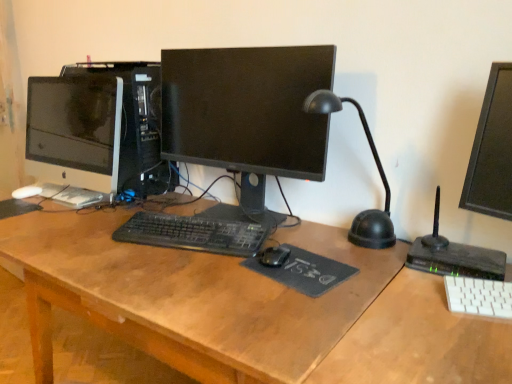
Find the location of a particular element. Image resolution: width=512 pixels, height=384 pixels. black glossy monitor at center, the 2th computer monitor viewed from the left is located at coordinates click(x=247, y=108).

Locate an element on the screen. This screenshot has height=384, width=512. black rubber mousepad at center, which is the second mousepad from bottom to top is located at coordinates (16, 208).

How much space does black rubber mousepad at center, which ranks as the first mousepad in back-to-front order, occupy vertically?

The height of black rubber mousepad at center, which ranks as the first mousepad in back-to-front order, is 0.76 inches.

This screenshot has width=512, height=384. Identify the location of black matte keyboard at center, which is counted as the second computer keyboard, starting from the front. (193, 233).

The height and width of the screenshot is (384, 512). What are the coordinates of `black plastic computer tower at center` in the screenshot? It's located at (137, 126).

Where is `black matte mouse at center`? This screenshot has width=512, height=384. black matte mouse at center is located at coordinates pos(274,256).

From the image's perspective, which is below, black rubber mousepad at center, which is the second mousepad from bottom to top, or black plastic desk lamp at center right?

black rubber mousepad at center, which is the second mousepad from bottom to top, from the image's perspective.

Is black rubber mousepad at center, which appears as the 2th mousepad when viewed from the right, oriented towards black plastic desk lamp at center right?

No, black rubber mousepad at center, which appears as the 2th mousepad when viewed from the right, does not turn towards black plastic desk lamp at center right.

Does black rubber mousepad at center, which appears as the 1th mousepad when viewed from the left, touch black plastic desk lamp at center right?

No, black rubber mousepad at center, which appears as the 1th mousepad when viewed from the left, is not in contact with black plastic desk lamp at center right.

Looking at their sizes, would you say black rubber mousepad at center, which is the second mousepad from bottom to top, is wider or thinner than black plastic desk lamp at center right?

Clearly, black rubber mousepad at center, which is the second mousepad from bottom to top, has less width compared to black plastic desk lamp at center right.

Considering the relative sizes of white glossy monitor at left, the 1th computer monitor positioned from the left, and black fabric mousepad at center, positioned as the 2th mousepad in back-to-front order, in the image provided, is white glossy monitor at left, the 1th computer monitor positioned from the left, smaller than black fabric mousepad at center, positioned as the 2th mousepad in back-to-front order,?

No.

Where is `the 2nd computer monitor above when counting from the black fabric mousepad at center, which appears as the 1th mousepad when viewed from the front (from the image's perspective)`? The width and height of the screenshot is (512, 384). the 2nd computer monitor above when counting from the black fabric mousepad at center, which appears as the 1th mousepad when viewed from the front (from the image's perspective) is located at coordinates (75, 131).

Can you confirm if white glossy monitor at left, the 1th computer monitor positioned from the left, is positioned to the left of black fabric mousepad at center, which is the first mousepad in right-to-left order?

Yes, white glossy monitor at left, the 1th computer monitor positioned from the left, is to the left of black fabric mousepad at center, which is the first mousepad in right-to-left order.

Between point (99, 116) and point (307, 275), which one is positioned behind?

The point (99, 116) is more distant.

Based on the photo, considering the positions of objects black plastic computer tower at center and wooden desk at center in the image provided, who is more to the right, black plastic computer tower at center or wooden desk at center?

Positioned to the right is wooden desk at center.

From a real-world perspective, is black plastic computer tower at center beneath wooden desk at center?

No, from a real-world perspective, black plastic computer tower at center is not beneath wooden desk at center.

In the scene shown: Considering the relative sizes of black plastic computer tower at center and wooden desk at center in the image provided, is black plastic computer tower at center shorter than wooden desk at center?

Indeed, black plastic computer tower at center has a lesser height compared to wooden desk at center.

How different are the orientations of black plastic computer tower at center and wooden desk at center in degrees?

0.388 degrees separate the facing orientations of black plastic computer tower at center and wooden desk at center.

From the image's perspective, relative to black rubber mousepad at center, marked as the 1th mousepad in a top-to-bottom arrangement, is black matte keyboard at center, which is counted as the second computer keyboard, starting from the front, above or below?

black matte keyboard at center, which is counted as the second computer keyboard, starting from the front, is situated lower than black rubber mousepad at center, marked as the 1th mousepad in a top-to-bottom arrangement, in the image.

Considering the positions of objects black matte keyboard at center, the 1th computer keyboard when ordered from back to front, and black rubber mousepad at center, marked as the 1th mousepad in a top-to-bottom arrangement, in the image provided, who is more to the left, black matte keyboard at center, the 1th computer keyboard when ordered from back to front, or black rubber mousepad at center, marked as the 1th mousepad in a top-to-bottom arrangement,?

From the viewer's perspective, black rubber mousepad at center, marked as the 1th mousepad in a top-to-bottom arrangement, appears more on the left side.

At what (x,y) coordinates should I click in order to perform the action: click on mousepad lying on the left of black matte keyboard at center, the 1th computer keyboard when ordered from back to front. Please return your answer as a coordinate pair (x, y). The height and width of the screenshot is (384, 512). Looking at the image, I should click on coord(16,208).

Is black matte keyboard at center, the 1th computer keyboard when ordered from top to bottom, positioned with its back to black rubber mousepad at center, which appears as the 2th mousepad when viewed from the right?

No, black matte keyboard at center, the 1th computer keyboard when ordered from top to bottom, is not facing away from black rubber mousepad at center, which appears as the 2th mousepad when viewed from the right.

What's the angular difference between black rubber mousepad at center, the 2th mousepad positioned from the front, and black matte mouse at center's facing directions?

19.8 degrees.

Is point (2, 210) positioned before point (283, 248)?

No.

How much distance is there between black rubber mousepad at center, which is the second mousepad from bottom to top, and black matte mouse at center?

black rubber mousepad at center, which is the second mousepad from bottom to top, and black matte mouse at center are 38.99 inches apart from each other.

Is black rubber mousepad at center, which appears as the 1th mousepad when viewed from the left, positioned with its back to black matte mouse at center?

That's not correct — black rubber mousepad at center, which appears as the 1th mousepad when viewed from the left, is not looking away from black matte mouse at center.

From a real-world perspective, is black matte mouse at center over black plastic computer tower at center?

No, from a real-world perspective, black matte mouse at center is not over black plastic computer tower at center

Is black matte mouse at center positioned beyond the bounds of black plastic computer tower at center?

Yes, black matte mouse at center is outside of black plastic computer tower at center.

Considering the positions of points (274, 250) and (132, 70), is point (274, 250) farther from camera compared to point (132, 70)?

No.

Is the position of black matte mouse at center more distant than that of black plastic computer tower at center?

That is False.

Considering the points (510, 316) and (128, 92), which point is behind, point (510, 316) or point (128, 92)?

The point (128, 92) is farther from the camera.

Which of these two, white plastic keyboard at lower right, which ranks as the 2th computer keyboard in back-to-front order, or black plastic computer tower at center, stands shorter?

white plastic keyboard at lower right, which ranks as the 2th computer keyboard in back-to-front order.

Is white plastic keyboard at lower right, the 1th computer keyboard viewed from the right, closer to the viewer compared to black plastic computer tower at center?

Yes, it is in front of black plastic computer tower at center.

From a real-world perspective, relative to black plastic computer tower at center, is white plastic keyboard at lower right, which ranks as the 1th computer keyboard in bottom-to-top order, vertically above or below?

From a real-world perspective, white plastic keyboard at lower right, which ranks as the 1th computer keyboard in bottom-to-top order, is physically below black plastic computer tower at center.

Image resolution: width=512 pixels, height=384 pixels. Identify the location of the 2nd mousepad behind the black plastic desk lamp at center right, counting from the anchor's position. (16, 208).

The image size is (512, 384). Find the location of `mousepad in front of the white glossy monitor at left, acting as the second computer monitor starting from the right`. mousepad in front of the white glossy monitor at left, acting as the second computer monitor starting from the right is located at coordinates (303, 271).

Estimate the real-world distances between objects in this image. Which object is further from black matte mouse at center, black plastic desk lamp at center right or black glossy monitor at center, the 1th computer monitor viewed from the right?

Based on the image, black glossy monitor at center, the 1th computer monitor viewed from the right, appears to be further to black matte mouse at center.

Based on their spatial positions, is white glossy monitor at left, acting as the second computer monitor starting from the right, or black plastic desk lamp at center right closer to black plastic computer tower at center?

Among the two, white glossy monitor at left, acting as the second computer monitor starting from the right, is located nearer to black plastic computer tower at center.

Looking at the image, which one is located further to black fabric mousepad at center, marked as the 2th mousepad in a top-to-bottom arrangement, black plastic desk lamp at center right or black matte keyboard at center, the 1th computer keyboard when ordered from top to bottom?

black plastic desk lamp at center right is further to black fabric mousepad at center, marked as the 2th mousepad in a top-to-bottom arrangement.

Considering their positions, is black rubber mousepad at center, which is the second mousepad from bottom to top, positioned further to black plastic computer tower at center than wooden desk at center?

wooden desk at center is further to black plastic computer tower at center.

When comparing their distances from black matte keyboard at center, the 1th computer keyboard when ordered from back to front, does wooden desk at center or black rubber mousepad at center, which appears as the 1th mousepad when viewed from the left, seem further?

black rubber mousepad at center, which appears as the 1th mousepad when viewed from the left, is further to black matte keyboard at center, the 1th computer keyboard when ordered from back to front.

From the picture: When comparing their distances from black fabric mousepad at center, which appears as the 1th mousepad when viewed from the front, does black plastic computer tower at center or white glossy monitor at left, the 1th computer monitor positioned from the left, seem further?

white glossy monitor at left, the 1th computer monitor positioned from the left, is further to black fabric mousepad at center, which appears as the 1th mousepad when viewed from the front.

From the image, which object appears to be farther from white plastic keyboard at lower right, which ranks as the 1th computer keyboard in bottom-to-top order, black fabric mousepad at center, which appears as the 1th mousepad when viewed from the front, or black rubber mousepad at center, which appears as the 1th mousepad when viewed from the left?

black rubber mousepad at center, which appears as the 1th mousepad when viewed from the left.

Considering their positions, is white plastic keyboard at lower right, positioned as the 2th computer keyboard in top-to-bottom order, positioned closer to white glossy monitor at left, acting as the second computer monitor starting from the right, than black plastic computer tower at center?

black plastic computer tower at center is closer to white glossy monitor at left, acting as the second computer monitor starting from the right.

Identify the location of table lamp between white glossy monitor at left, the 1th computer monitor positioned from the left, and white plastic keyboard at lower right, which ranks as the 1th computer keyboard in bottom-to-top order, from left to right. (377, 168).

Image resolution: width=512 pixels, height=384 pixels. I want to click on computer monitor between white glossy monitor at left, the 1th computer monitor positioned from the left, and black matte mouse at center from left to right, so click(x=247, y=108).

Where is `table lamp between black glossy monitor at center, the 2th computer monitor viewed from the left, and wooden desk at center from top to bottom`? table lamp between black glossy monitor at center, the 2th computer monitor viewed from the left, and wooden desk at center from top to bottom is located at coordinates (377, 168).

Where is `computer monitor between white glossy monitor at left, the 1th computer monitor positioned from the left, and white plastic keyboard at lower right, positioned as the 2th computer keyboard in top-to-bottom order, from left to right`? This screenshot has height=384, width=512. computer monitor between white glossy monitor at left, the 1th computer monitor positioned from the left, and white plastic keyboard at lower right, positioned as the 2th computer keyboard in top-to-bottom order, from left to right is located at coordinates (247, 108).